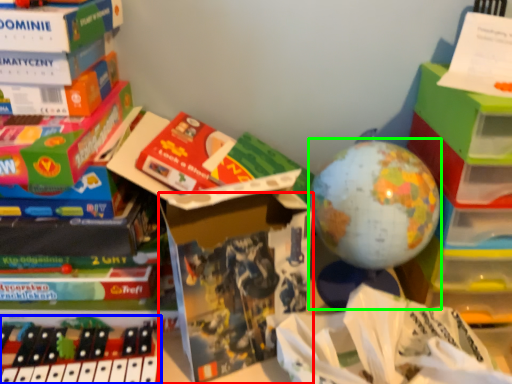
Question: Which object is positioned farthest from paperback book (highlighted by a red box)? Select from toy (highlighted by a blue box) and toy (highlighted by a green box).

Choices:
 (A) toy
 (B) toy

Answer: (A)